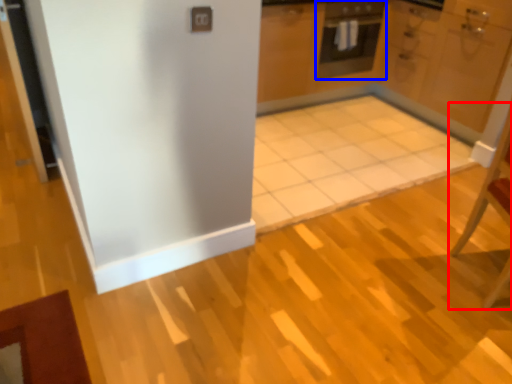
Question: Which of the following is the closest to the observer, chair (highlighted by a red box) or oven (highlighted by a blue box)?

Choices:
 (A) chair
 (B) oven

Answer: (A)